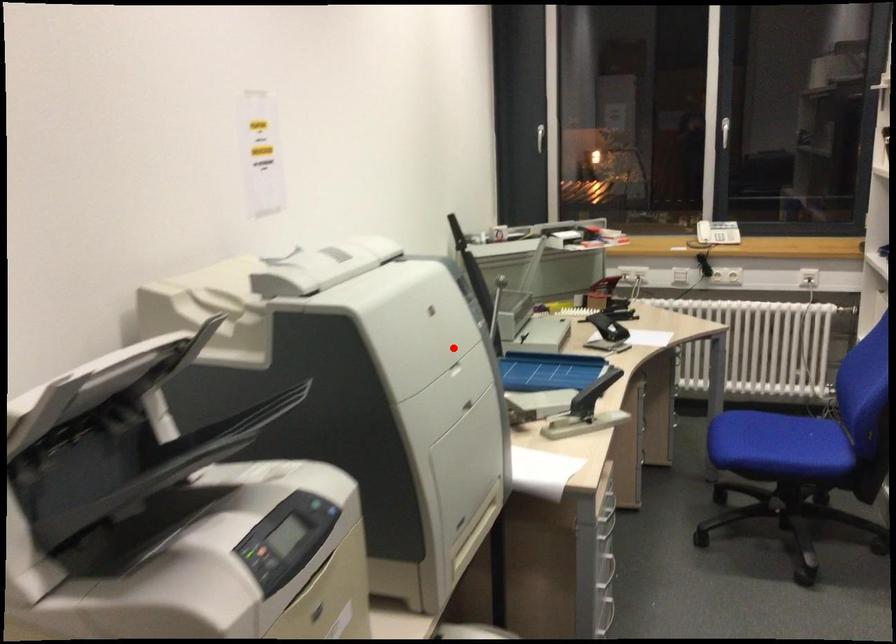
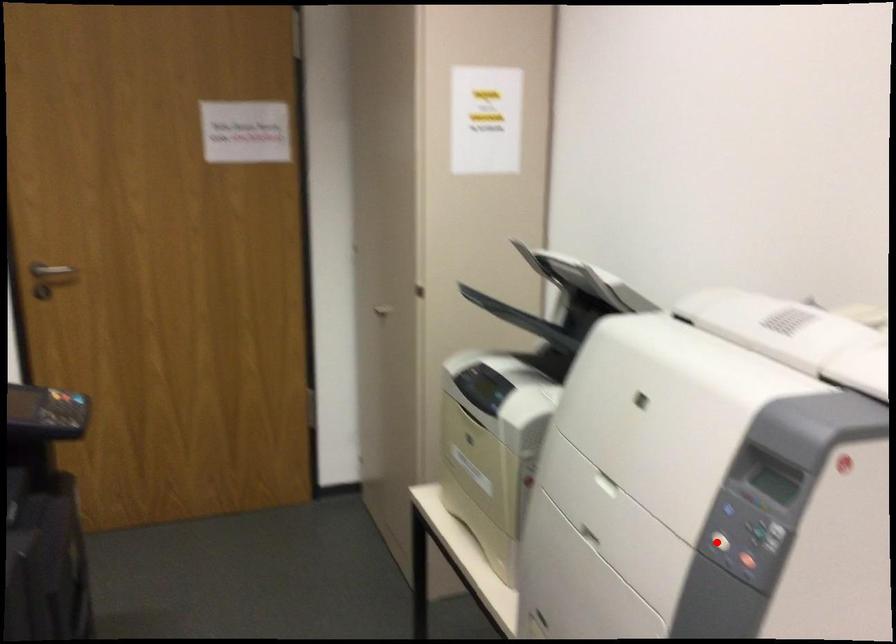
I am providing you with two images of the same scene from different viewpoints. A red point is marked on the first image and another point is marked on the second image. Do the highlighted points in image1 and image2 indicate the same real-world spot?

Yes